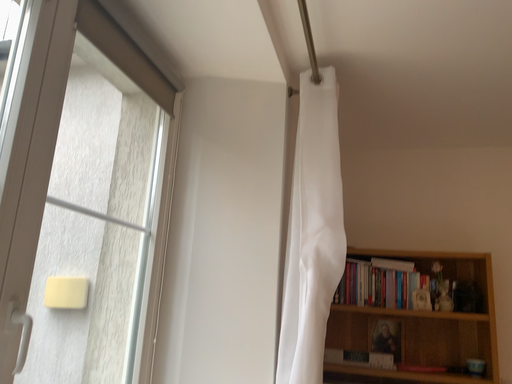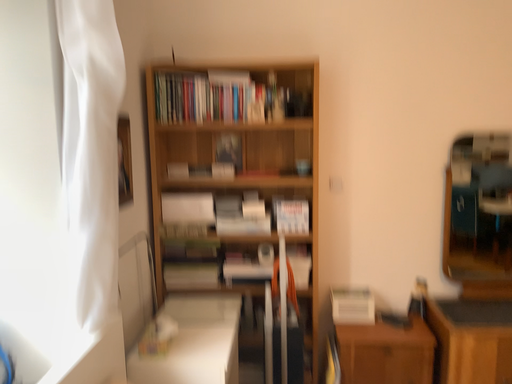
Question: Which way did the camera rotate in the video?

Choices:
 (A) rotated right
 (B) rotated left

Answer: (A)